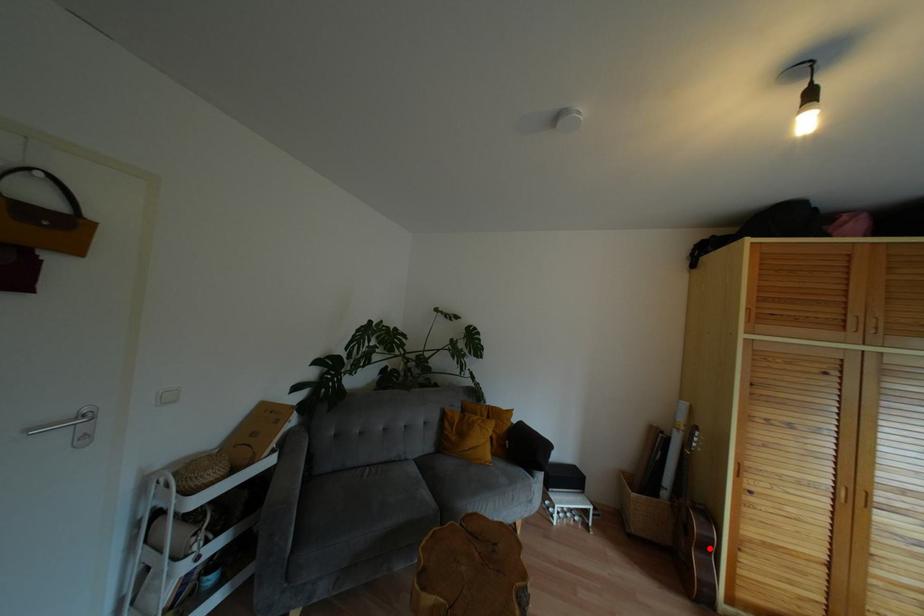
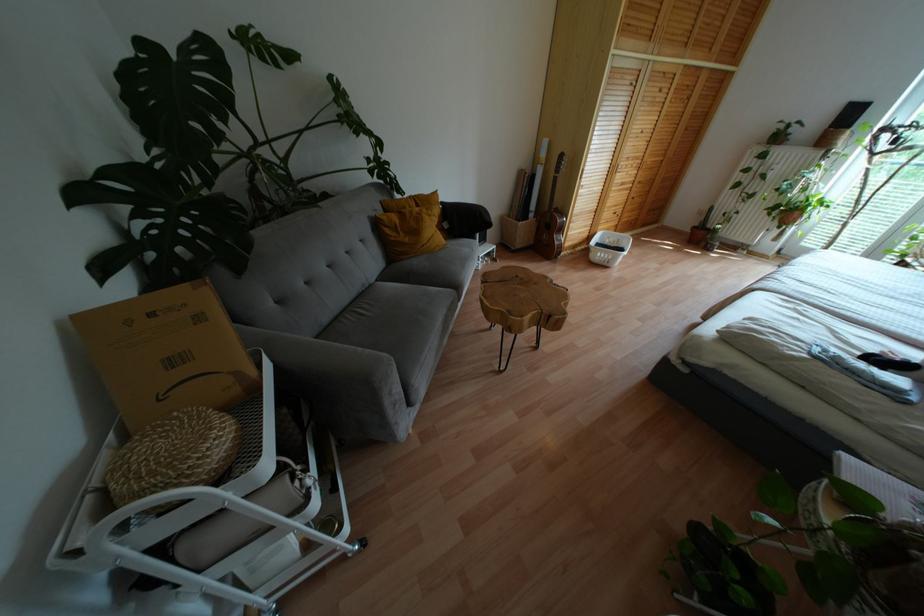
Question: I am providing you with two images of the same scene from different viewpoints. A red point is shown in image1. For the corresponding object point in image2, is it positioned nearer or farther from the camera?

Choices:
 (A) Nearer
 (B) Farther

Answer: (A)